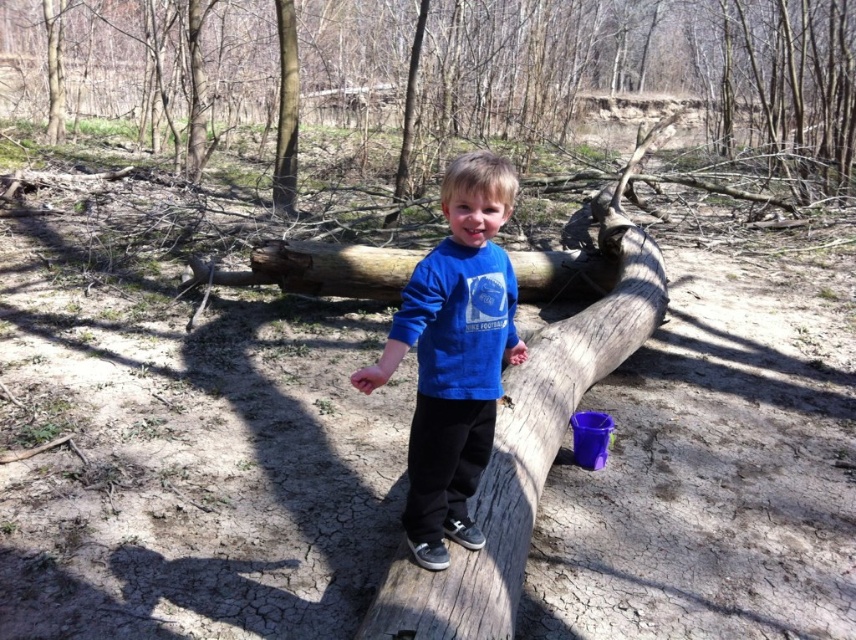
Question: Is smooth brown log at center further to the viewer compared to blue cotton shirt at center?

Choices:
 (A) yes
 (B) no

Answer: (A)

Question: Observing the image, what is the correct spatial positioning of smooth brown log at center in reference to blue cotton shirt at center?

Choices:
 (A) above
 (B) below

Answer: (A)

Question: Which point is farther to the camera?

Choices:
 (A) [x=417, y=403]
 (B) [x=637, y=51]

Answer: (B)

Question: Which of the following is the farthest from the observer?

Choices:
 (A) smooth brown log at center
 (B) blue cotton shirt at center

Answer: (A)

Question: Can you confirm if smooth brown log at center is positioned below blue cotton shirt at center?

Choices:
 (A) no
 (B) yes

Answer: (A)